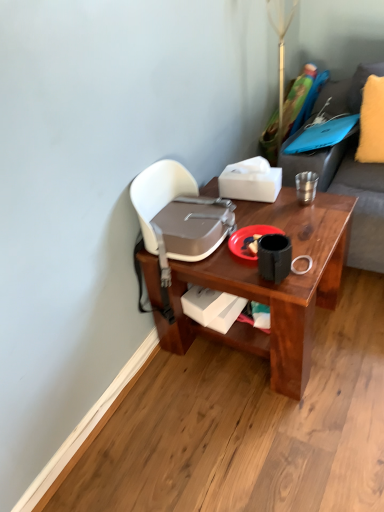
Image resolution: width=384 pixels, height=512 pixels. I want to click on vacant space situated above red matte plate at center (from a real-world perspective), so click(x=247, y=239).